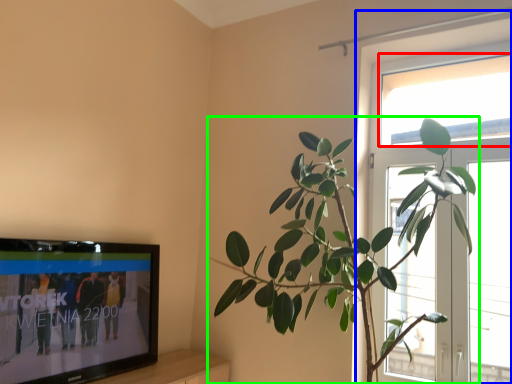
Question: Considering the real-world distances, which object is farthest from window screen (highlighted by a red box)? window (highlighted by a blue box) or houseplant (highlighted by a green box)?

Choices:
 (A) window
 (B) houseplant

Answer: (B)